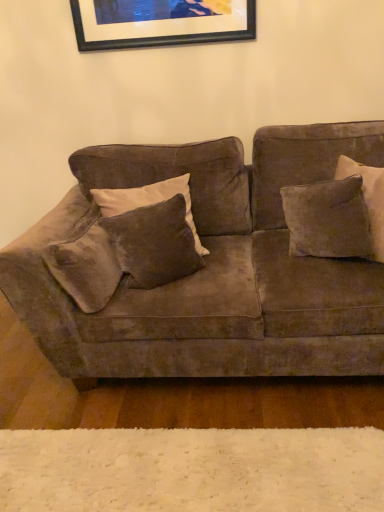
Question: Is velvet brown pillow at center, positioned as the 2th pillow in right-to-left order, positioned before velvet brown pillow at right, the 2th pillow when ordered from left to right?

Choices:
 (A) yes
 (B) no

Answer: (A)

Question: From a real-world perspective, is velvet brown pillow at center, the first pillow positioned from the left, positioned under velvet brown pillow at right, which is the first pillow in right-to-left order, based on gravity?

Choices:
 (A) no
 (B) yes

Answer: (A)

Question: Is velvet brown pillow at center, the first pillow positioned from the left, surrounding velvet brown pillow at right, the 2th pillow when ordered from left to right?

Choices:
 (A) yes
 (B) no

Answer: (B)

Question: Can you confirm if velvet brown pillow at center, positioned as the 2th pillow in right-to-left order, is shorter than velvet brown pillow at right, which is the first pillow in right-to-left order?

Choices:
 (A) yes
 (B) no

Answer: (B)

Question: Are velvet brown pillow at center, the first pillow positioned from the left, and velvet brown pillow at right, which is the first pillow in right-to-left order, beside each other?

Choices:
 (A) no
 (B) yes

Answer: (A)

Question: Is velvet brown pillow at center, positioned as the 2th pillow in right-to-left order, taller or shorter than velvet brown pillow at right, the 2th pillow when ordered from left to right?

Choices:
 (A) tall
 (B) short

Answer: (A)

Question: Looking at their shapes, would you say velvet brown pillow at center, positioned as the 2th pillow in right-to-left order, is wider or thinner than velvet brown pillow at right, the 2th pillow when ordered from left to right?

Choices:
 (A) thin
 (B) wide

Answer: (A)

Question: Considering the positions of point (187, 222) and point (317, 209), is point (187, 222) closer or farther from the camera than point (317, 209)?

Choices:
 (A) closer
 (B) farther

Answer: (B)

Question: Based on their positions, is velvet brown pillow at center, positioned as the 2th pillow in right-to-left order, located to the left or right of velvet brown pillow at right, which is the first pillow in right-to-left order?

Choices:
 (A) right
 (B) left

Answer: (B)

Question: From the image's perspective, is white fluffy rug at lower center located above or below black matte picture frame at upper center?

Choices:
 (A) above
 (B) below

Answer: (B)

Question: Is white fluffy rug at lower center taller or shorter than black matte picture frame at upper center?

Choices:
 (A) tall
 (B) short

Answer: (B)

Question: Is point pyautogui.click(x=144, y=458) closer or farther from the camera than point pyautogui.click(x=177, y=25)?

Choices:
 (A) closer
 (B) farther

Answer: (A)

Question: In the image, is white fluffy rug at lower center on the left side or the right side of black matte picture frame at upper center?

Choices:
 (A) right
 (B) left

Answer: (A)

Question: Is velvet brown pillow at center, positioned as the 2th pillow in right-to-left order, taller or shorter than black matte picture frame at upper center?

Choices:
 (A) tall
 (B) short

Answer: (A)

Question: From a real-world perspective, is velvet brown pillow at center, positioned as the 2th pillow in right-to-left order, positioned above or below black matte picture frame at upper center?

Choices:
 (A) above
 (B) below

Answer: (B)